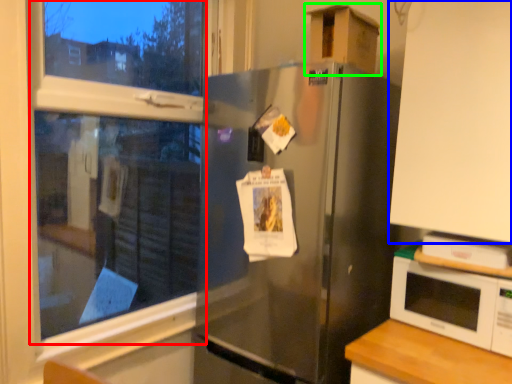
Question: Estimate the real-world distances between objects in this image. Which object is closer to bay window (highlighted by a red box), cabinetry (highlighted by a blue box) or cardboard box (highlighted by a green box)?

Choices:
 (A) cabinetry
 (B) cardboard box

Answer: (B)